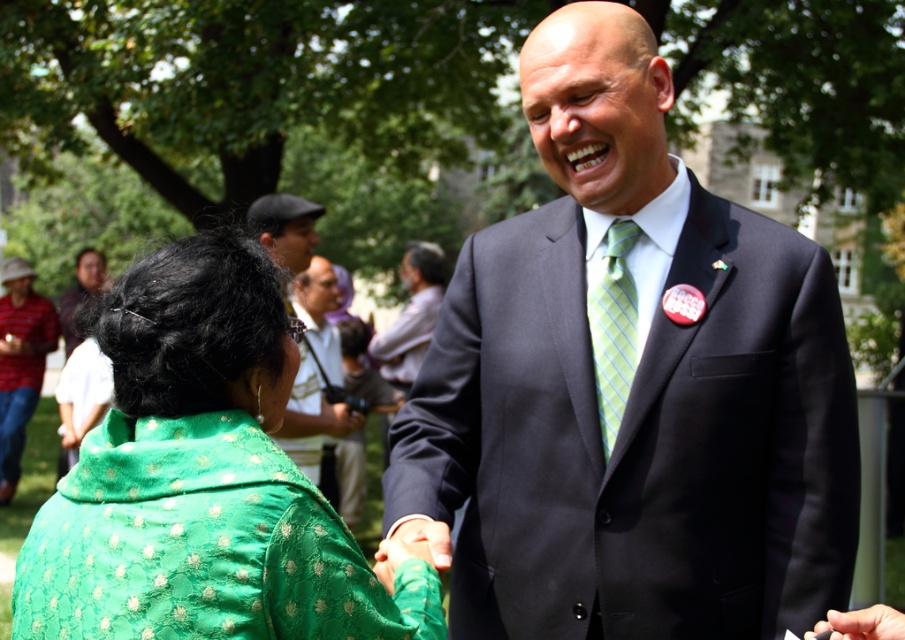
You are standing at the origin point of the coordinate system. There are two points marked in the image, point (1,394) and point (279,209). Which point is closer to you?

Point (279,209) is closer to you because it is in front of point (1,394).

You are a photographer trying to capture a candid shot of both the striped cotton shirt at left and the matte black cap at upper center in the same frame. Based on their positions, will you need to adjust your camera angle upwards or downwards to include both in the shot?

The striped cotton shirt at left is below matte black cap at upper center, so to capture both in the same frame, you would need to adjust your camera angle upwards to include the matte black cap at upper center while still keeping the striped cotton shirt at left in view.

You are a fashion designer observing the two individuals in the scene. You need to determine which item of clothing is smaller in size between the green plaid tie at center and the matte black suit at upper center. Which one is smaller?

A: The green plaid tie at center has a smaller size compared to the matte black suit at upper center, so the green plaid tie at center is the smaller one.